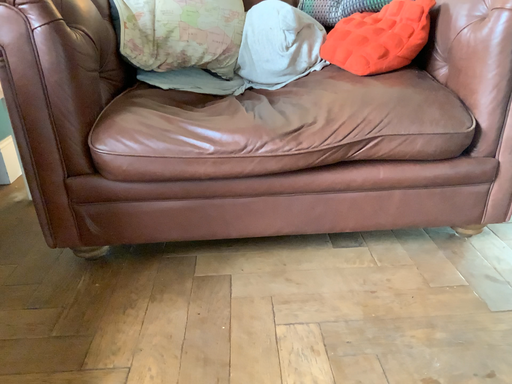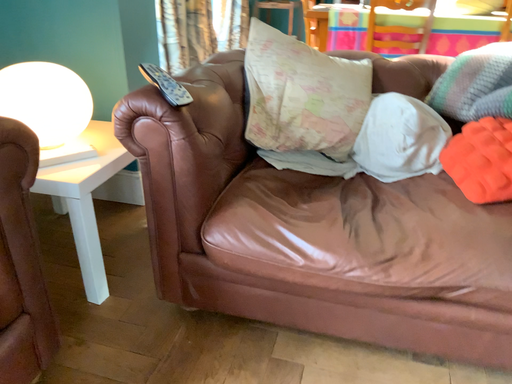
Question: Which way did the camera rotate in the video?

Choices:
 (A) rotated right
 (B) rotated left

Answer: (B)